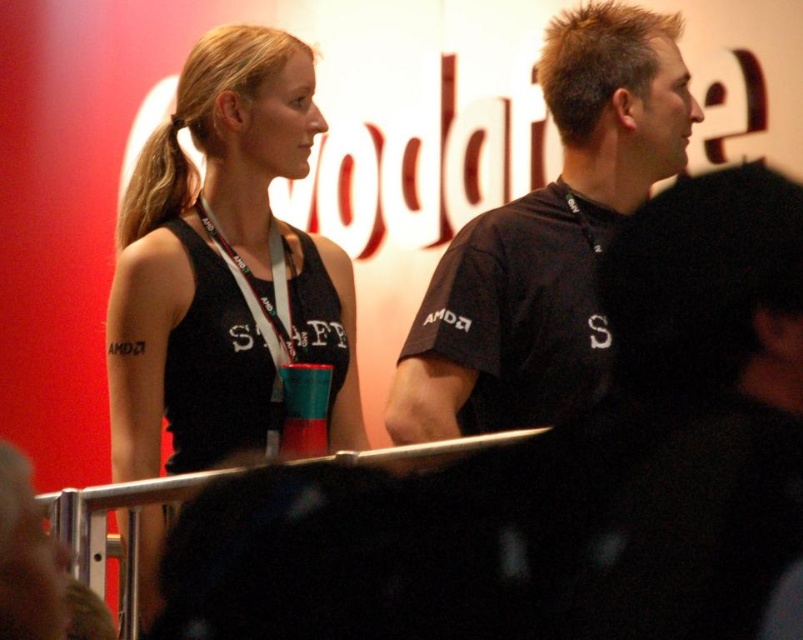
Question: Does black matte tank top at upper left have a larger size compared to black matte shirt at upper right?

Choices:
 (A) no
 (B) yes

Answer: (B)

Question: In this image, where is black matte tank top at upper left located relative to black matte shirt at upper right?

Choices:
 (A) below
 (B) above

Answer: (A)

Question: Does black matte tank top at upper left have a lesser width compared to black matte shirt at upper right?

Choices:
 (A) yes
 (B) no

Answer: (A)

Question: Which point appears farthest from the camera in this image?

Choices:
 (A) (567, 163)
 (B) (223, 244)

Answer: (A)